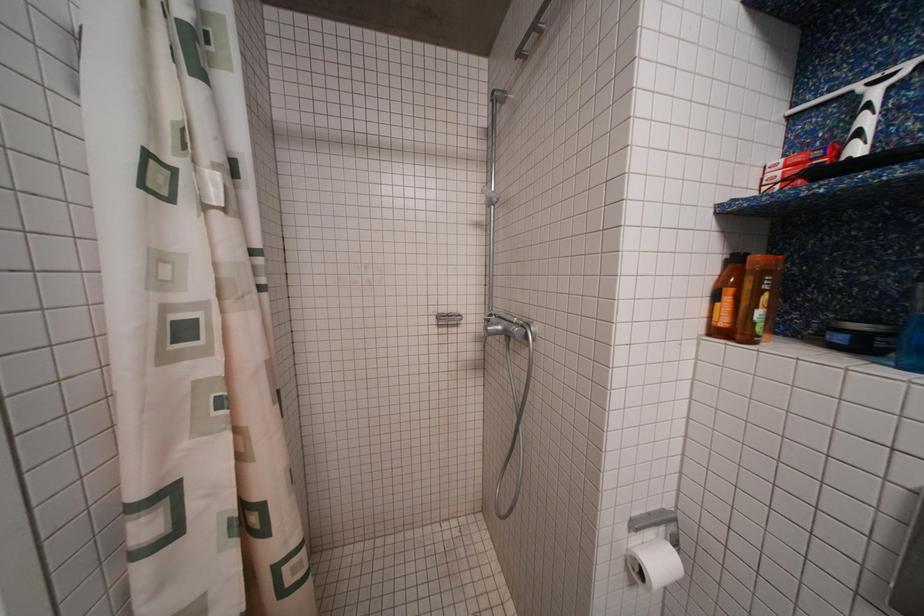
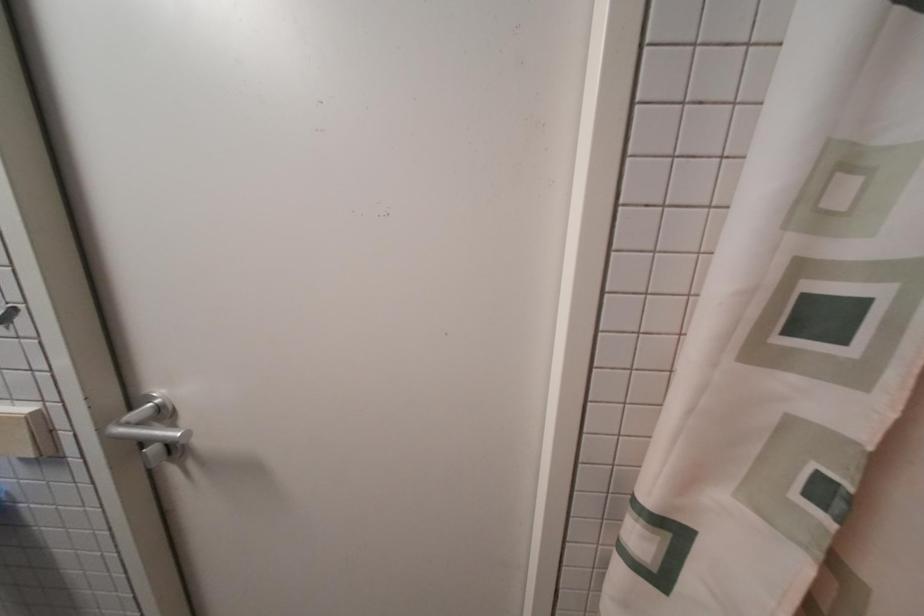
Question: The camera is either moving clockwise (left) or counter-clockwise (right) around the object. The first image is from the beginning of the video and the second image is from the end. Is the camera moving left or right when shooting the video?

Choices:
 (A) Left
 (B) Right

Answer: (B)